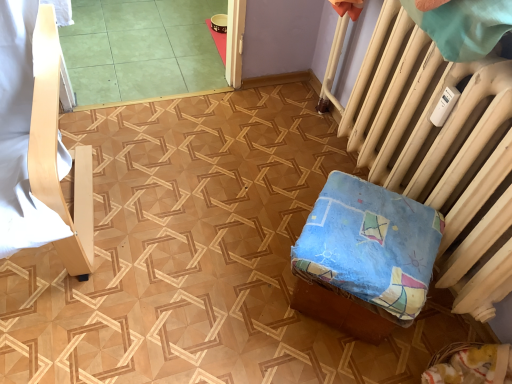
The width and height of the screenshot is (512, 384). Find the location of `free spot to the left of white painted radiator at right`. free spot to the left of white painted radiator at right is located at coordinates (184, 177).